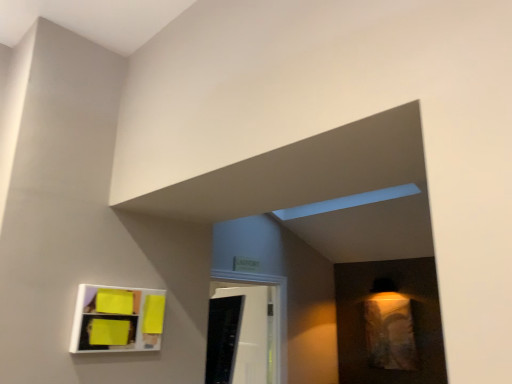
Locate an element on the screen. Image resolution: width=512 pixels, height=384 pixels. white glossy shelf at lower left is located at coordinates (117, 319).

The height and width of the screenshot is (384, 512). What do you see at coordinates (117, 319) in the screenshot? I see `white glossy shelf at lower left` at bounding box center [117, 319].

The image size is (512, 384). Identify the location of white glossy shelf at lower left. (117, 319).